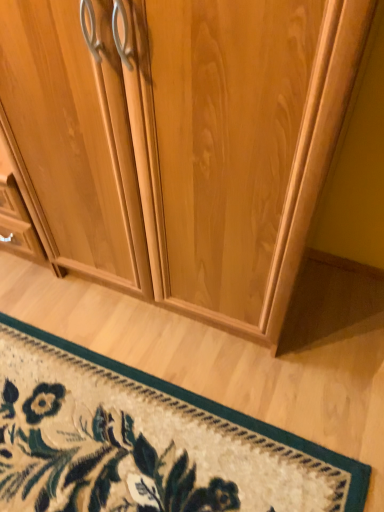
Image resolution: width=384 pixels, height=512 pixels. I want to click on vacant space situated above floral carpet at lower left (from a real-world perspective), so click(123, 438).